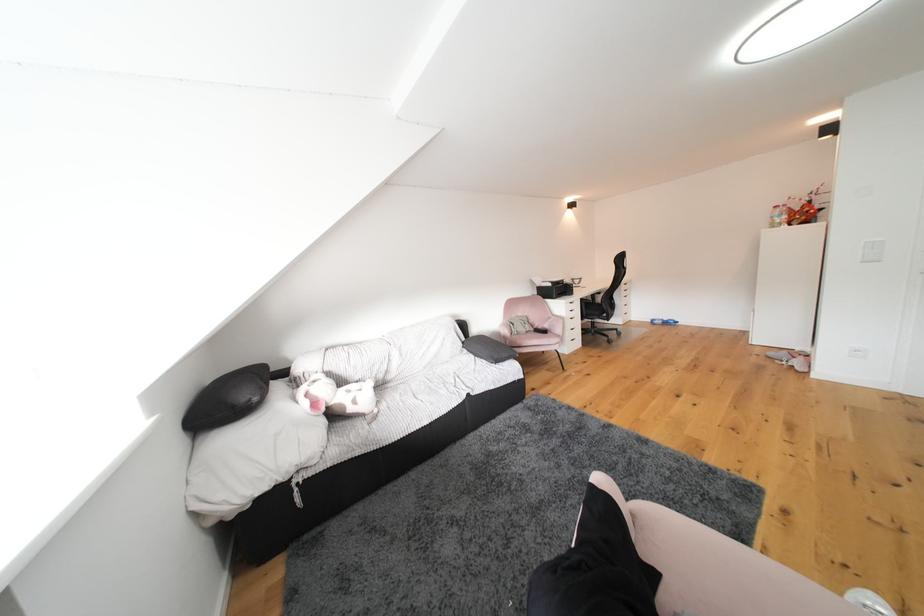
Where would you sit the black chair sitting surface? Please return your answer as a coordinate pair (x, y).

(591, 306)